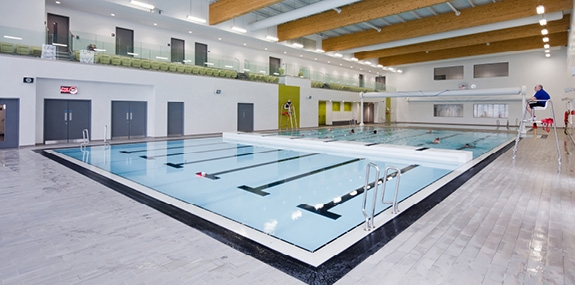
This screenshot has height=285, width=575. What are the coordinates of `wooden supports` in the screenshot? It's located at (237, 7), (323, 23), (383, 34), (443, 45), (450, 54).